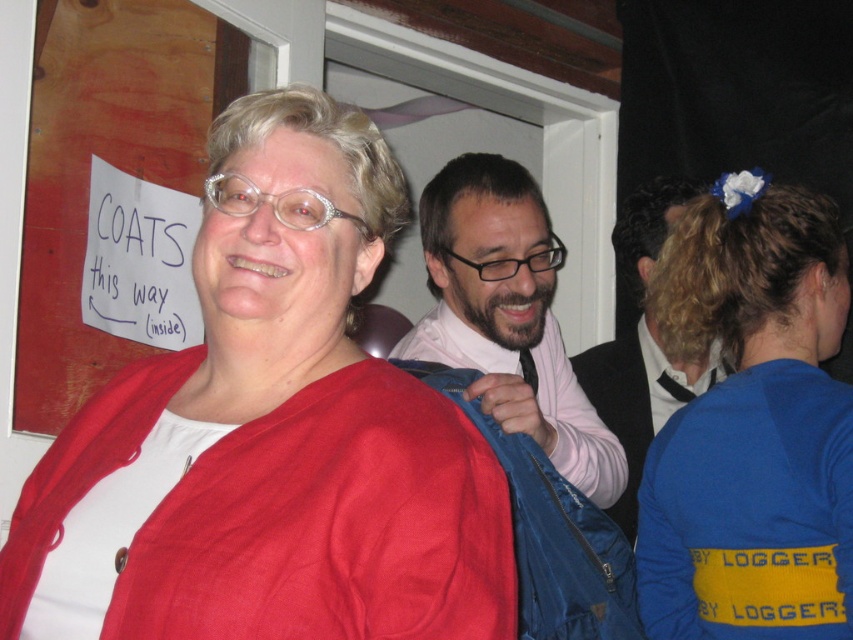
Who is more forward, [645,273] or [532,365]?

Point [532,365] is in front.

Is matte black suit at center to the right of black silk tie at center from the viewer's perspective?

Yes, matte black suit at center is to the right of black silk tie at center.

Who is more distant from viewer, (689, 369) or (523, 380)?

The point (689, 369) is behind.

The image size is (853, 640). I want to click on matte black suit at center, so click(x=641, y=342).

Based on the photo, which is more to the right, matte blue jacket at center or matte black suit at center?

matte black suit at center is more to the right.

Between matte blue jacket at center and matte black suit at center, which one appears on the left side from the viewer's perspective?

Positioned to the left is matte blue jacket at center.

At what (x,y) coordinates should I click in order to perform the action: click on matte blue jacket at center. Please return your answer as a coordinate pair (x, y). Looking at the image, I should click on (508, 314).

This screenshot has height=640, width=853. In order to click on matte blue jacket at center in this screenshot , I will do `click(508, 314)`.

From the picture: Is matte red sweater at center closer to the viewer compared to matte blue jacket at center?

Yes.

Which is in front, point (421, 388) or point (569, 467)?

Point (421, 388) is more forward.

At what (x,y) coordinates should I click in order to perform the action: click on matte red sweater at center. Please return your answer as a coordinate pair (x, y). Looking at the image, I should click on click(x=283, y=426).